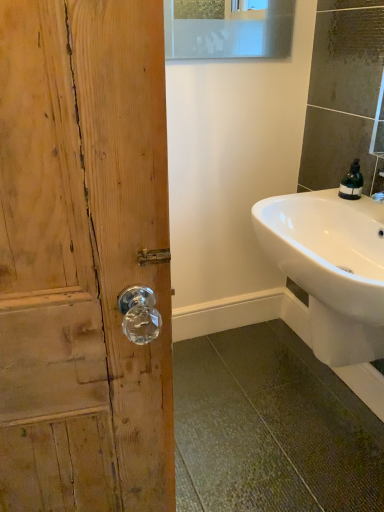
Question: In the image, is green matte soap dispenser at upper right positioned in front of or behind white glossy sink at lower right?

Choices:
 (A) front
 (B) behind

Answer: (B)

Question: Considering the positions of green matte soap dispenser at upper right and white glossy sink at lower right in the image, is green matte soap dispenser at upper right taller or shorter than white glossy sink at lower right?

Choices:
 (A) tall
 (B) short

Answer: (B)

Question: Based on their positions, is green matte soap dispenser at upper right located to the left or right of white glossy sink at lower right?

Choices:
 (A) right
 (B) left

Answer: (A)

Question: From the image's perspective, is white glossy sink at lower right above or below green matte soap dispenser at upper right?

Choices:
 (A) below
 (B) above

Answer: (A)

Question: In terms of width, does white glossy sink at lower right look wider or thinner when compared to green matte soap dispenser at upper right?

Choices:
 (A) wide
 (B) thin

Answer: (A)

Question: Considering their positions, is white glossy sink at lower right located in front of or behind green matte soap dispenser at upper right?

Choices:
 (A) behind
 (B) front

Answer: (B)

Question: From a real-world perspective, is white glossy sink at lower right positioned above or below green matte soap dispenser at upper right?

Choices:
 (A) above
 (B) below

Answer: (B)